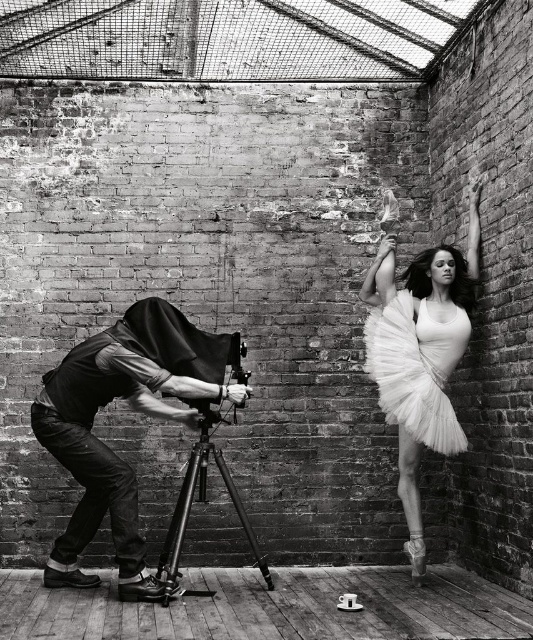
Question: Which point is closer to the camera?

Choices:
 (A) (36, 422)
 (B) (390, 348)
 (C) (434, 426)
 (D) (167, 554)

Answer: (A)

Question: Which point appears closest to the camera in this image?

Choices:
 (A) [x=451, y=451]
 (B) [x=61, y=536]

Answer: (A)

Question: Which object is closer to the camera taking this photo?

Choices:
 (A) white fluffy tutu at upper right
 (B) denim vest at left
 (C) metallic tripod at center
 (D) white tulle dress at upper right

Answer: (C)

Question: Is white tulle dress at upper right bigger than metallic tripod at center?

Choices:
 (A) yes
 (B) no

Answer: (B)

Question: Does white tulle dress at upper right come behind metallic tripod at center?

Choices:
 (A) yes
 (B) no

Answer: (A)

Question: From the image, what is the correct spatial relationship of white fluffy tutu at upper right in relation to white tulle dress at upper right?

Choices:
 (A) below
 (B) above

Answer: (A)